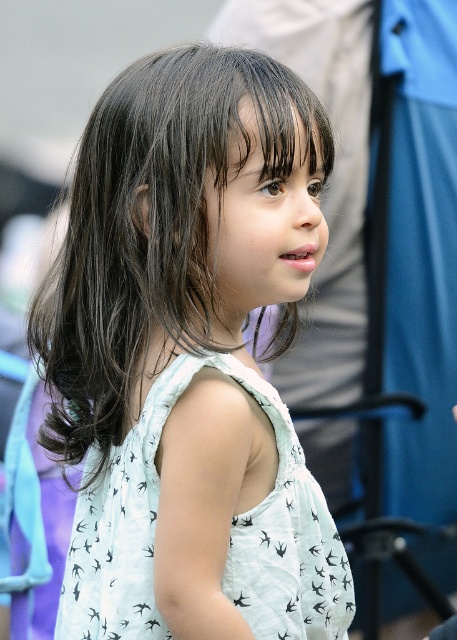
You are a photographer trying to capture the child in the white printed dress at center and the white printed fabric dress at center. Since the dresses are similar, how can you distinguish them in your photo?

The white printed dress at center is wider than the white printed fabric dress at center, so you can focus on the width difference to distinguish them in your photo.

You are a photographer trying to capture a clear shot of the child in the white printed dress at center and the white printed fabric dress at center. Which dress should you focus on if you want to photograph the one closer to the left side?

The white printed dress at center is to the left of the white printed fabric dress at center, so you should focus on the white printed dress at center to capture the one closer to the left side.